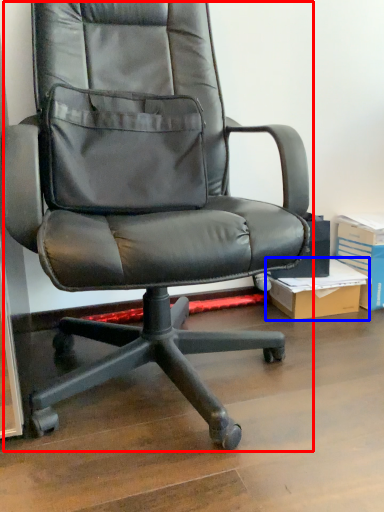
Question: Which point is closer to the camera, chair (highlighted by a red box) or cardboard box (highlighted by a blue box)?

Choices:
 (A) chair
 (B) cardboard box

Answer: (A)